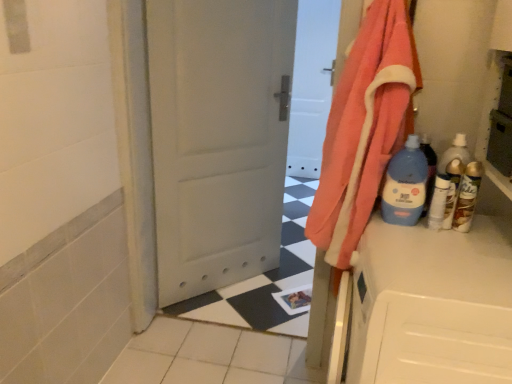
Question: Considering the relative sizes of orange cotton towel at right and white glossy bottle at right, the 2th bottle from the left, in the image provided, is orange cotton towel at right thinner than white glossy bottle at right, the 2th bottle from the left,?

Choices:
 (A) yes
 (B) no

Answer: (B)

Question: Can you confirm if orange cotton towel at right is positioned to the left of white glossy bottle at right, arranged as the 3th bottle when viewed from the right?

Choices:
 (A) no
 (B) yes

Answer: (B)

Question: From the image's perspective, is orange cotton towel at right above white glossy bottle at right, the 2th bottle from the left?

Choices:
 (A) yes
 (B) no

Answer: (A)

Question: From the image's perspective, does orange cotton towel at right appear lower than white glossy bottle at right, the 2th bottle from the left?

Choices:
 (A) yes
 (B) no

Answer: (B)

Question: Can you confirm if orange cotton towel at right is wider than white glossy bottle at right, the 2th bottle from the left?

Choices:
 (A) no
 (B) yes

Answer: (B)

Question: From a real-world perspective, is gold metallic spray can at right, marked as the fourth bottle in a left-to-right arrangement, above or below blue plastic bottle at right, placed as the 4th bottle when sorted from right to left?

Choices:
 (A) below
 (B) above

Answer: (A)

Question: Does point (470, 210) appear closer or farther from the camera than point (384, 198)?

Choices:
 (A) closer
 (B) farther

Answer: (A)

Question: Considering the positions of gold metallic spray can at right, marked as the fourth bottle in a left-to-right arrangement, and blue plastic bottle at right, placed as the 1th bottle when sorted from left to right, in the image, is gold metallic spray can at right, marked as the fourth bottle in a left-to-right arrangement, wider or thinner than blue plastic bottle at right, placed as the 1th bottle when sorted from left to right,?

Choices:
 (A) wide
 (B) thin

Answer: (B)

Question: Is gold metallic spray can at right, placed as the first bottle when sorted from right to left, taller or shorter than blue plastic bottle at right, placed as the 1th bottle when sorted from left to right?

Choices:
 (A) short
 (B) tall

Answer: (A)

Question: Is white glossy bottle at right, the 2th bottle from the left, taller or shorter than blue plastic bottle at right, placed as the 1th bottle when sorted from left to right?

Choices:
 (A) short
 (B) tall

Answer: (A)

Question: In terms of width, does white glossy bottle at right, the 2th bottle from the left, look wider or thinner when compared to blue plastic bottle at right, placed as the 4th bottle when sorted from right to left?

Choices:
 (A) thin
 (B) wide

Answer: (A)

Question: Considering their positions, is white glossy bottle at right, the 2th bottle from the left, located in front of or behind blue plastic bottle at right, placed as the 1th bottle when sorted from left to right?

Choices:
 (A) front
 (B) behind

Answer: (B)

Question: From a real-world perspective, is white glossy bottle at right, arranged as the 3th bottle when viewed from the right, physically located above or below blue plastic bottle at right, placed as the 4th bottle when sorted from right to left?

Choices:
 (A) above
 (B) below

Answer: (B)

Question: Considering their positions, is orange cotton towel at right located in front of or behind white glossy bottle at right, the 2th bottle from the left?

Choices:
 (A) behind
 (B) front

Answer: (B)

Question: From the image's perspective, is orange cotton towel at right located above or below white glossy bottle at right, arranged as the 3th bottle when viewed from the right?

Choices:
 (A) above
 (B) below

Answer: (A)